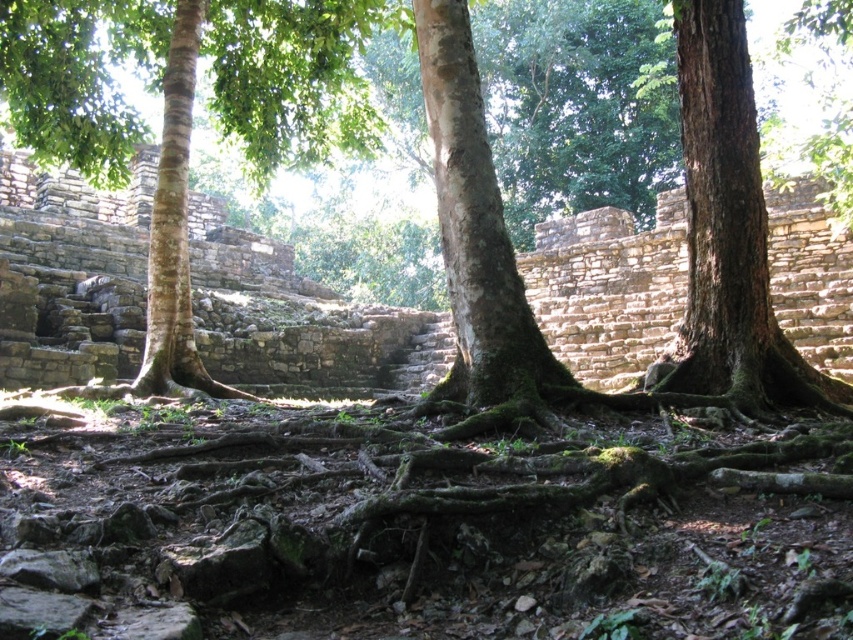
You are an archaeologist examining the ancient stone structure. You notice the brown rough tree trunk at left and the green rough bark tree at center. Which tree trunk is located to the left of the other?

The brown rough tree trunk at left is positioned on the left side of green rough bark tree at center.

You are an archaeologist examining the ancient stone structure. You notice the brown rough tree trunk at left and the green rough bark tree at center. Which tree has a larger trunk size?

The brown rough tree trunk at left is bigger than the green rough bark tree at center.

You are an archaeologist examining the ancient stone structure. You notice two trees near the ruins. Which tree has a wider trunk, the brown rough tree at center or the brown rough tree trunk at left?

The brown rough tree at center has a wider trunk than the brown rough tree trunk at left.